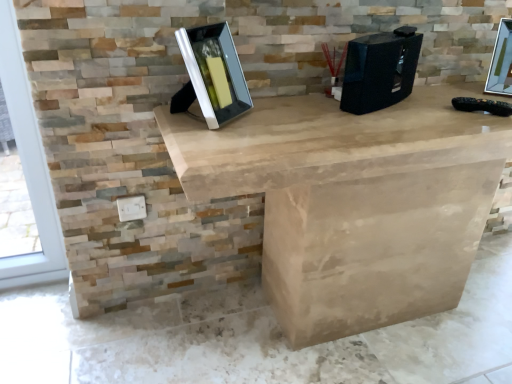
Question: Is matte black picture frame at center, which is counted as the first picture frame, starting from the left, beside metallic silver picture frame at upper right, which is the first picture frame from right to left?

Choices:
 (A) no
 (B) yes

Answer: (A)

Question: Can you confirm if matte black picture frame at center, positioned as the 2th picture frame in back-to-front order, is wider than metallic silver picture frame at upper right, which is the first picture frame from right to left?

Choices:
 (A) yes
 (B) no

Answer: (A)

Question: Does matte black picture frame at center, positioned as the 2th picture frame in back-to-front order, appear on the left side of metallic silver picture frame at upper right, which is counted as the 2th picture frame, starting from the front?

Choices:
 (A) yes
 (B) no

Answer: (A)

Question: Is matte black picture frame at center, positioned as the 2th picture frame in back-to-front order, at the right side of metallic silver picture frame at upper right, which is the first picture frame from right to left?

Choices:
 (A) yes
 (B) no

Answer: (B)

Question: Considering the relative sizes of matte black picture frame at center, which ranks as the second picture frame in right-to-left order, and metallic silver picture frame at upper right, which is counted as the 2th picture frame, starting from the front, in the image provided, is matte black picture frame at center, which ranks as the second picture frame in right-to-left order, bigger than metallic silver picture frame at upper right, which is counted as the 2th picture frame, starting from the front,?

Choices:
 (A) yes
 (B) no

Answer: (A)

Question: Is matte black picture frame at center, which ranks as the second picture frame in right-to-left order, spatially inside black plastic desktop computer at center, or outside of it?

Choices:
 (A) inside
 (B) outside

Answer: (B)

Question: From their relative heights in the image, would you say matte black picture frame at center, which ranks as the second picture frame in right-to-left order, is taller or shorter than black plastic desktop computer at center?

Choices:
 (A) short
 (B) tall

Answer: (B)

Question: In the image, is matte black picture frame at center, positioned as the 2th picture frame in back-to-front order, on the left side or the right side of black plastic desktop computer at center?

Choices:
 (A) left
 (B) right

Answer: (A)

Question: From a real-world perspective, relative to black plastic desktop computer at center, is matte black picture frame at center, positioned as the 2th picture frame in back-to-front order, vertically above or below?

Choices:
 (A) below
 (B) above

Answer: (B)

Question: In the image, is metallic silver picture frame at upper right, which is counted as the 2th picture frame, starting from the front, on the left side or the right side of black plastic desktop computer at center?

Choices:
 (A) right
 (B) left

Answer: (A)

Question: From the image's perspective, is metallic silver picture frame at upper right, the first picture frame when ordered from back to front, located above or below black plastic desktop computer at center?

Choices:
 (A) below
 (B) above

Answer: (B)

Question: In terms of height, does metallic silver picture frame at upper right, the 2th picture frame viewed from the left, look taller or shorter compared to black plastic desktop computer at center?

Choices:
 (A) short
 (B) tall

Answer: (B)

Question: Is point (508, 66) closer or farther from the camera than point (385, 66)?

Choices:
 (A) closer
 (B) farther

Answer: (B)

Question: Is black plastic desktop computer at center taller or shorter than metallic silver picture frame at upper right, the first picture frame when ordered from back to front?

Choices:
 (A) short
 (B) tall

Answer: (A)

Question: Considering the positions of black plastic desktop computer at center and metallic silver picture frame at upper right, the 2th picture frame viewed from the left, in the image, is black plastic desktop computer at center wider or thinner than metallic silver picture frame at upper right, the 2th picture frame viewed from the left,?

Choices:
 (A) thin
 (B) wide

Answer: (A)